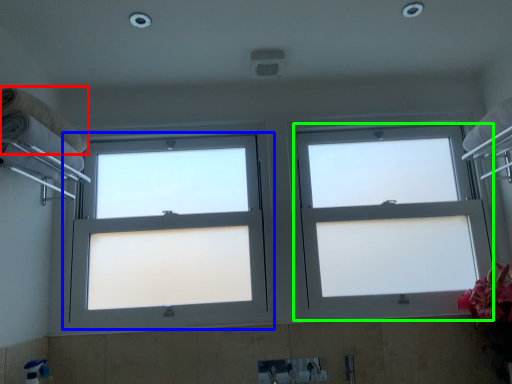
Question: Which is farther away from towel (highlighted by a red box)? window (highlighted by a blue box) or window (highlighted by a green box)?

Choices:
 (A) window
 (B) window

Answer: (B)